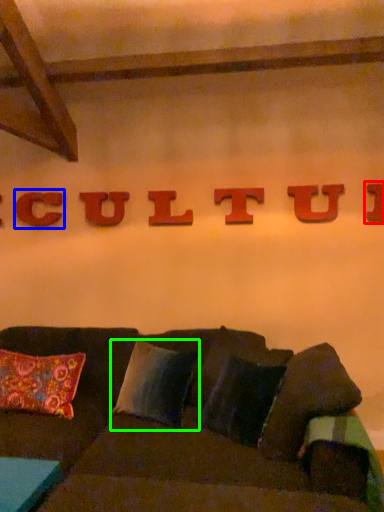
Question: Which object is positioned farthest from letter (highlighted by a red box)? Select from letter (highlighted by a blue box) and pillow (highlighted by a green box).

Choices:
 (A) letter
 (B) pillow

Answer: (A)